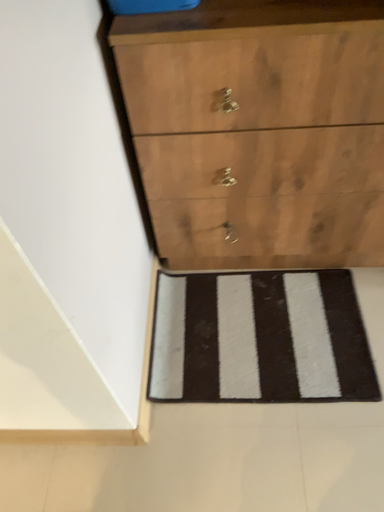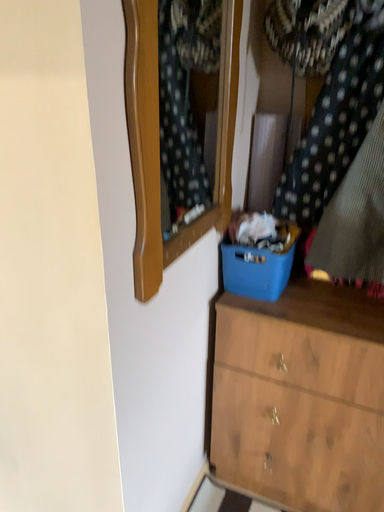
Question: Which way did the camera rotate in the video?

Choices:
 (A) rotated upward
 (B) rotated downward

Answer: (A)